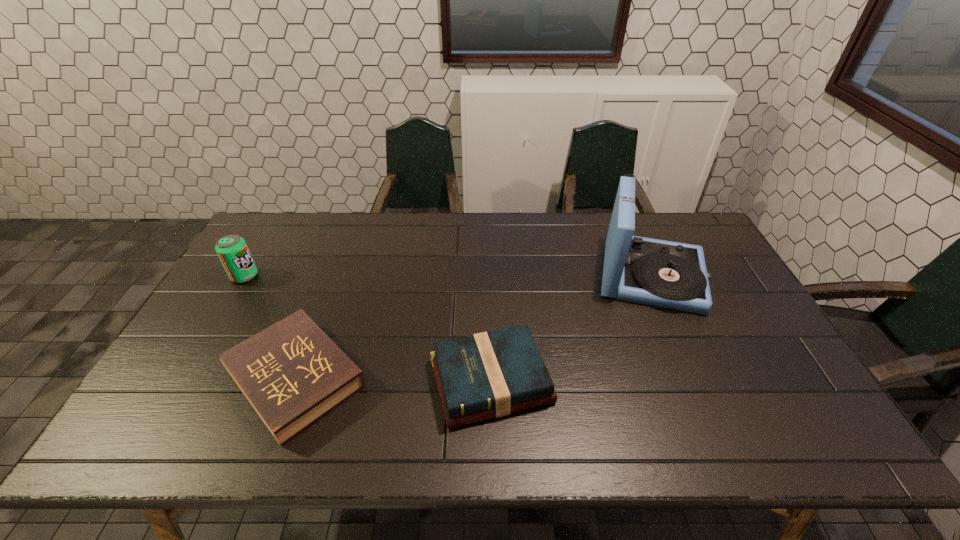
Find the location of a particular element. The height and width of the screenshot is (540, 960). vacant area that lies between the tallest object and the second object from right to left is located at coordinates (571, 328).

Choose which object is the third nearest neighbor to the third object from left to right. Please provide its 2D coordinates. Your answer should be formatted as a tuple, i.e. [(x, y)], where the tuple contains the x and y coordinates of a point satisfying the conditions above.

[(232, 250)]

Where is `object identified as the second closest to the leftmost object`? object identified as the second closest to the leftmost object is located at coordinates tap(487, 375).

You are a GUI agent. You are given a task and a screenshot of the screen. Output one action in this format:
    pyautogui.click(x=<x>, y=<y>)
    Task: Click on the free region that satisfies the following two spatial constraints: 1. on the front side of the phonograph record; 2. on the front-facing side of the second tallest object
    
    Given the screenshot: What is the action you would take?
    pyautogui.click(x=652, y=276)

In order to click on free space in the image that satisfies the following two spatial constraints: 1. on the front-facing side of the pop soda; 2. on the back side of the third object from right to left in this screenshot , I will do `click(184, 379)`.

Image resolution: width=960 pixels, height=540 pixels. Identify the location of vacant position in the image that satisfies the following two spatial constraints: 1. on the front-facing side of the pop soda; 2. on the left side of the left hardback book. (184, 379).